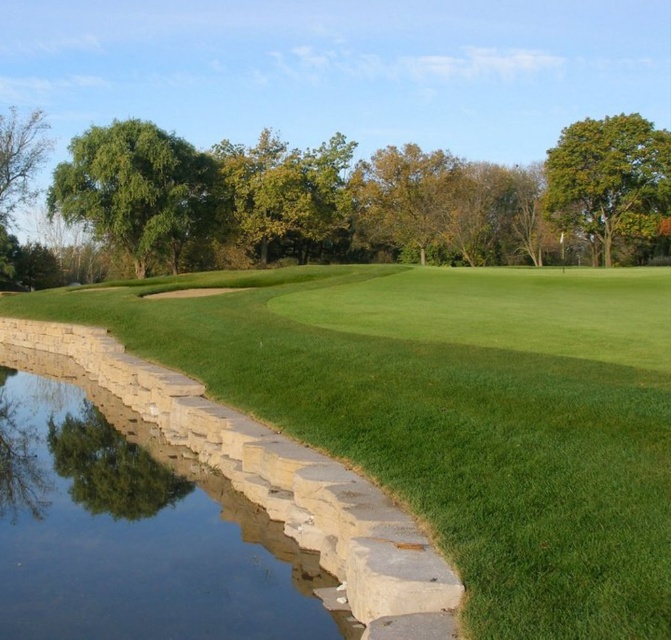
Between clear water at bottom left and green leafy tree at upper right, which one has less height?

With less height is clear water at bottom left.

Can you confirm if clear water at bottom left is thinner than green leafy tree at upper right?

Correct, clear water at bottom left's width is less than green leafy tree at upper right's.

Between point (74, 515) and point (599, 230), which one is positioned behind?

Point (599, 230)

At what (x,y) coordinates should I click in order to perform the action: click on clear water at bottom left. Please return your answer as a coordinate pair (x, y). Looking at the image, I should click on (132, 531).

Who is higher up, green leafy tree at left or clear water at bottom left?

green leafy tree at left

Can you confirm if green leafy tree at left is shorter than clear water at bottom left?

No.

Is point (525, 257) positioned in front of point (211, 625)?

No, (525, 257) is behind (211, 625).

This screenshot has height=640, width=671. In order to click on green leafy tree at left in this screenshot , I will do pos(358,200).

Does green grass at center appear over green leafy tree at upper right?

No, green grass at center is not above green leafy tree at upper right.

Which of these two, green grass at center or green leafy tree at upper right, stands shorter?

With less height is green grass at center.

Which is in front, point (576, 529) or point (605, 179)?

Point (576, 529)

The image size is (671, 640). Find the location of `green grass at center`. green grass at center is located at coordinates (456, 413).